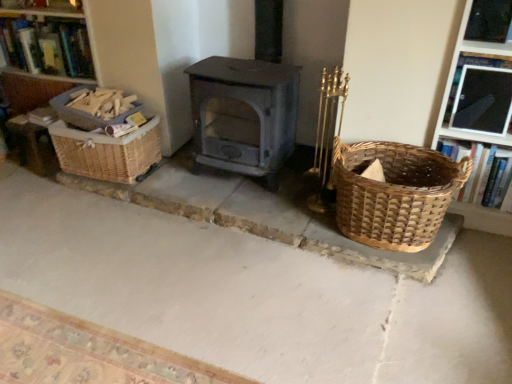
This screenshot has height=384, width=512. Find the location of `empty space that is in between woven brown basket at left, which appears as the second basket when viewed from the left, and woven brown basket at right, the 1th basket viewed from the right`. empty space that is in between woven brown basket at left, which appears as the second basket when viewed from the left, and woven brown basket at right, the 1th basket viewed from the right is located at coordinates (218, 190).